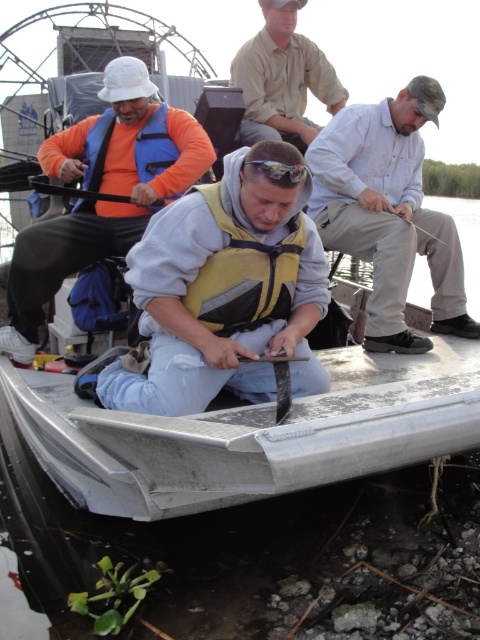
Question: Is the position of orange life vest at upper left less distant than that of khaki cotton shirt at upper center?

Choices:
 (A) yes
 (B) no

Answer: (A)

Question: Which of the following is the farthest from the observer?

Choices:
 (A) (82, 214)
 (B) (304, 86)

Answer: (B)

Question: In this image, where is silver metallic boat at center located relative to light blue shirt at center?

Choices:
 (A) right
 (B) left

Answer: (B)

Question: Which object is the farthest from the orange life vest at upper left?

Choices:
 (A) silver metallic boat at center
 (B) light blue shirt at center

Answer: (A)

Question: Observing the image, what is the correct spatial positioning of light blue shirt at center in reference to khaki cotton shirt at upper center?

Choices:
 (A) left
 (B) right

Answer: (B)

Question: Among these objects, which one is farthest from the camera?

Choices:
 (A) khaki cotton shirt at upper center
 (B) light blue shirt at center
 (C) orange life vest at upper left
 (D) silver metallic boat at center

Answer: (A)